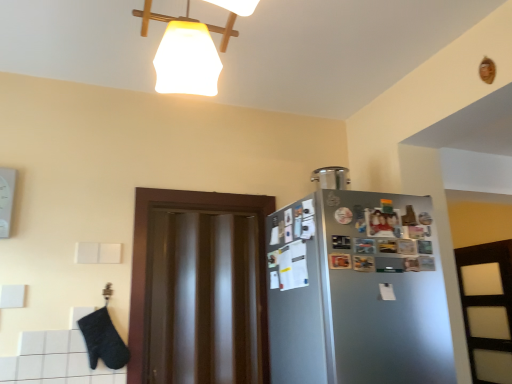
Question: Is satin silver container at upper right positioned far away from transparent glossy door at center?

Choices:
 (A) yes
 (B) no

Answer: (B)

Question: Is satin silver container at upper right facing away from transparent glossy door at center?

Choices:
 (A) no
 (B) yes

Answer: (A)

Question: Can you confirm if satin silver container at upper right is wider than transparent glossy door at center?

Choices:
 (A) no
 (B) yes

Answer: (B)

Question: Does satin silver container at upper right have a greater height compared to transparent glossy door at center?

Choices:
 (A) yes
 (B) no

Answer: (B)

Question: Would you say satin silver container at upper right contains transparent glossy door at center?

Choices:
 (A) yes
 (B) no

Answer: (B)

Question: From the image's perspective, relative to transparent glossy door at center, is satin silver fridge at right above or below?

Choices:
 (A) below
 (B) above

Answer: (A)

Question: Do you think satin silver fridge at right is within transparent glossy door at center, or outside of it?

Choices:
 (A) inside
 (B) outside

Answer: (B)

Question: Looking at their shapes, would you say satin silver fridge at right is wider or thinner than transparent glossy door at center?

Choices:
 (A) wide
 (B) thin

Answer: (A)

Question: In terms of height, does satin silver fridge at right look taller or shorter compared to transparent glossy door at center?

Choices:
 (A) short
 (B) tall

Answer: (A)

Question: Considering the positions of transparent glossy door at center and satin silver fridge at right in the image, is transparent glossy door at center bigger or smaller than satin silver fridge at right?

Choices:
 (A) big
 (B) small

Answer: (B)

Question: Choose the correct answer: Is transparent glossy door at center inside satin silver fridge at right or outside it?

Choices:
 (A) outside
 (B) inside

Answer: (A)

Question: In the image, is transparent glossy door at center on the left side or the right side of satin silver fridge at right?

Choices:
 (A) right
 (B) left

Answer: (B)

Question: In the image, is transparent glossy door at center positioned in front of or behind satin silver fridge at right?

Choices:
 (A) front
 (B) behind

Answer: (B)

Question: In the image, is satin silver container at upper right positioned in front of or behind transparent glossy door at center?

Choices:
 (A) front
 (B) behind

Answer: (B)

Question: From the image's perspective, is satin silver container at upper right located above or below transparent glossy door at center?

Choices:
 (A) below
 (B) above

Answer: (B)